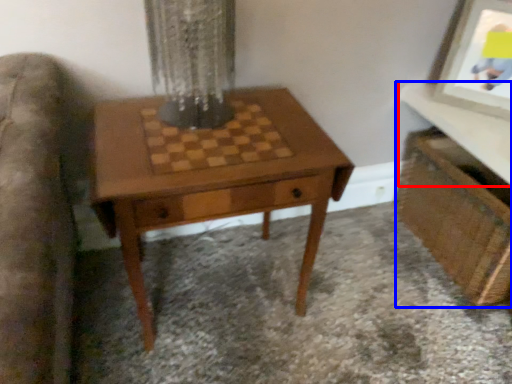
Question: Which object appears closest to the camera in this image, table top (highlighted by a red box) or vanity (highlighted by a blue box)?

Choices:
 (A) table top
 (B) vanity

Answer: (A)